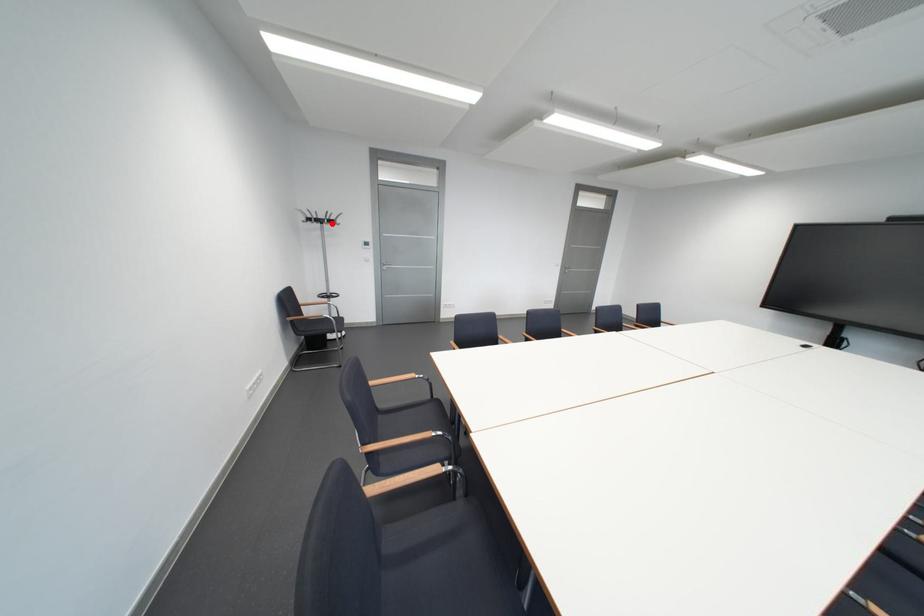
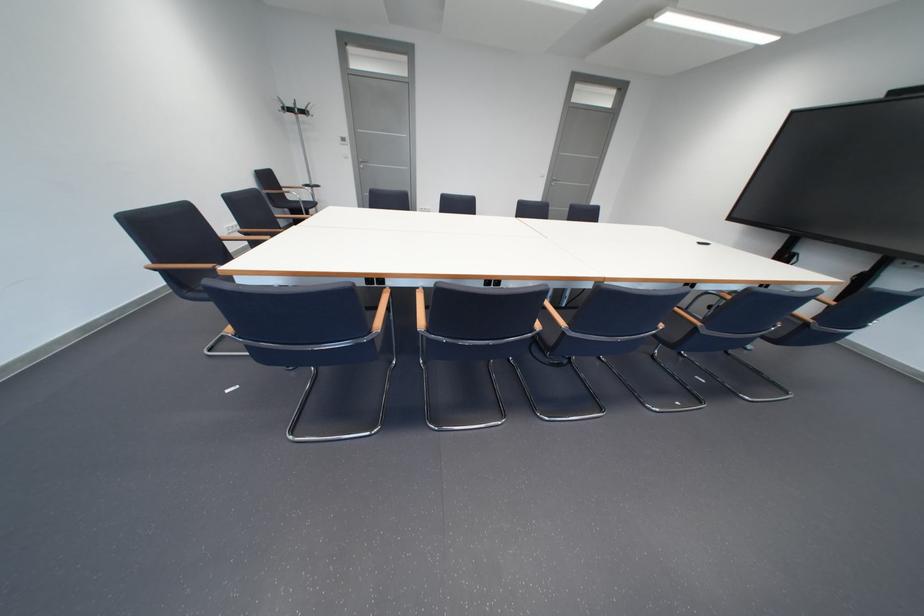
In the second image, find the point that corresponds to the highlighted location in the first image.

(304, 111)